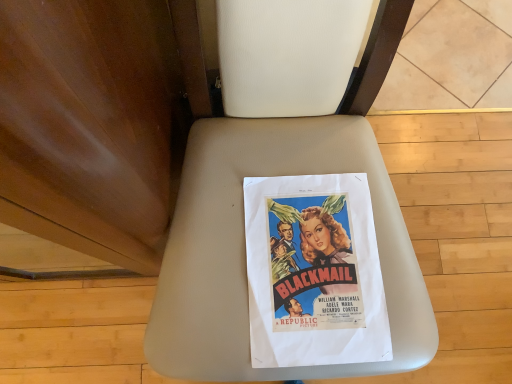
What is the approximate height of beige leather chair at center?

3.63 feet.

You are a GUI agent. You are given a task and a screenshot of the screen. Output one action in this format:
    pyautogui.click(x=<x>, y=<y>)
    Task: Click on the beige leather chair at center
    The image size is (512, 384).
    Given the screenshot: What is the action you would take?
    pyautogui.click(x=274, y=175)

Measure the distance between point (281, 130) and camera.

29.53 inches.

Describe the element at coordinates (274, 175) in the screenshot. The image size is (512, 384). I see `beige leather chair at center` at that location.

The image size is (512, 384). What are the coordinates of `beige leather chair at center` in the screenshot? It's located at (274, 175).